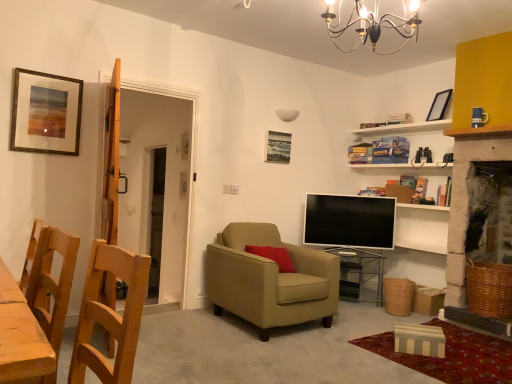
Where is `free space in front of transparent glass table at center`? Image resolution: width=512 pixels, height=384 pixels. free space in front of transparent glass table at center is located at coordinates (357, 309).